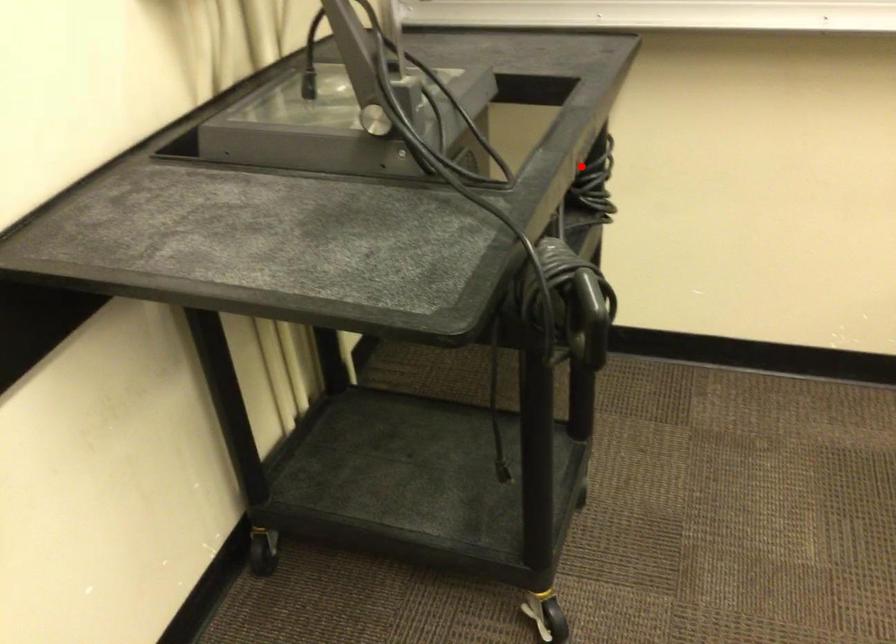
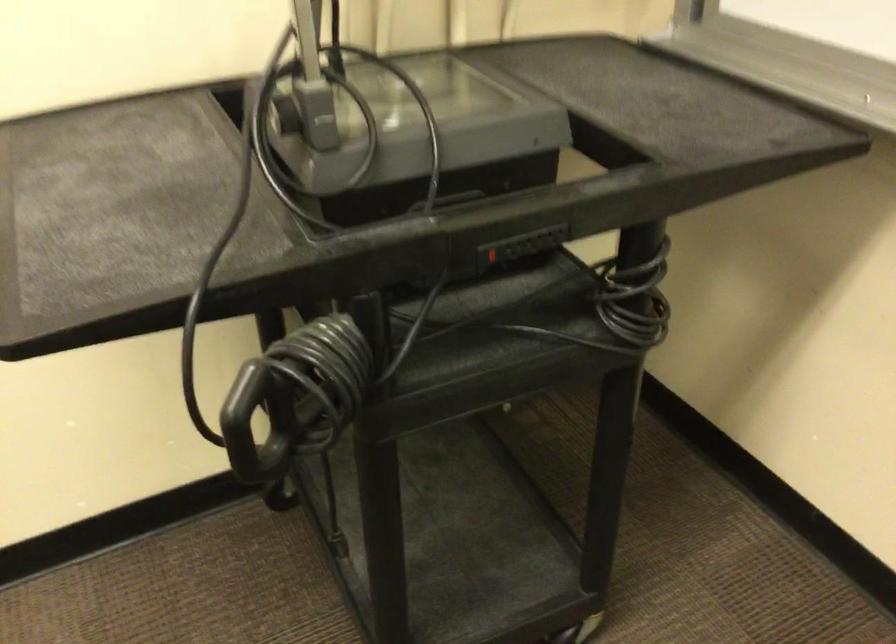
Question: A red point is marked in image1. In image2, is the corresponding 3D point closer to the camera or farther? Reply with the corresponding letter.

Choices:
 (A) The corresponding 3D point is closer.
 (B) The corresponding 3D point is farther.

Answer: (A)